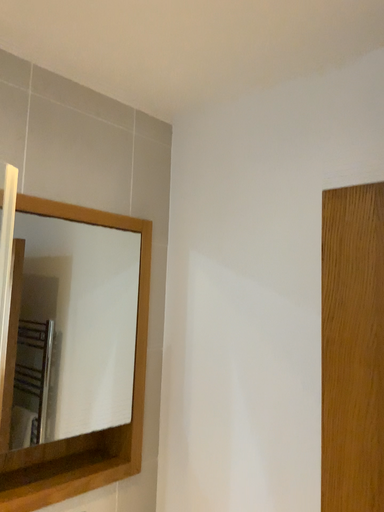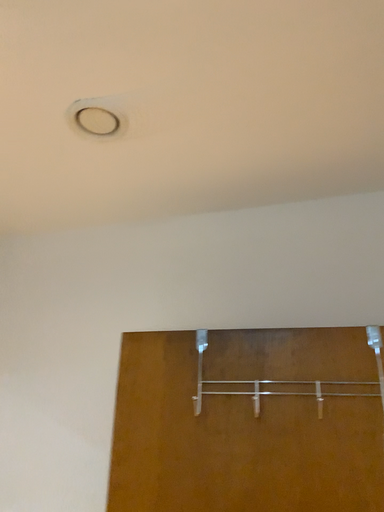
Question: How did the camera likely rotate when shooting the video?

Choices:
 (A) rotated right
 (B) rotated left

Answer: (A)